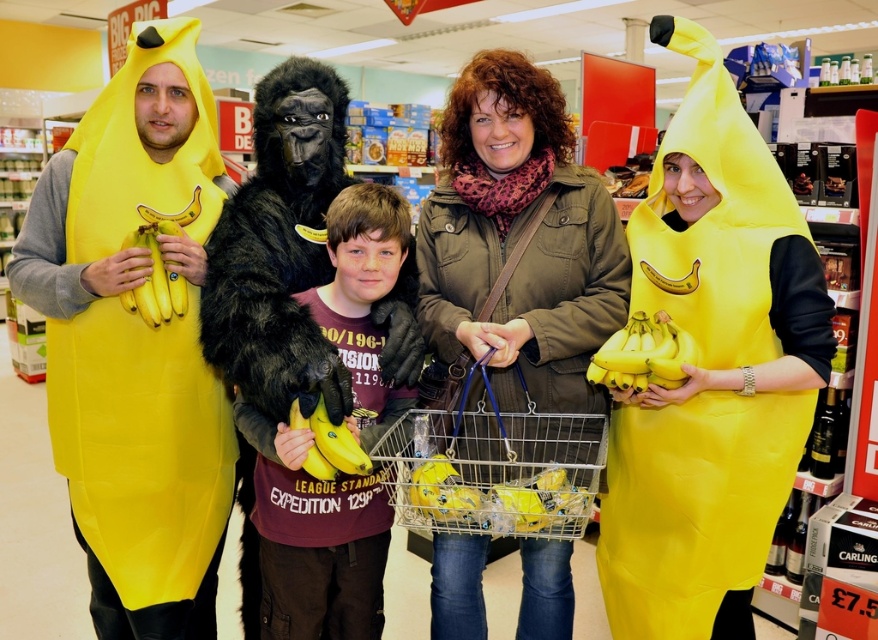
You are a customer in the supermarket and see the two banana displays. The matte yellow banana at left and the yellow matte bananas at right are both for sale. Which one is positioned more to the east side of the store?

The matte yellow banana at left is positioned more to the east side of the store because it is to the left of the yellow matte bananas at right, and in the image, left corresponds to east.